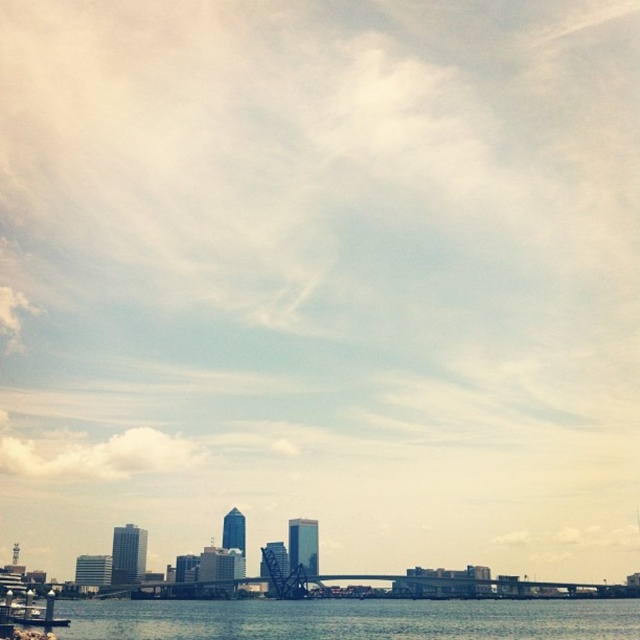
You are standing at the point where the bridge connects to the shore. You want to walk to the clear water at lower center located at point (352,620). Which direction should you head towards?

You should head towards the lower center direction to reach the clear water at lower center located at point (352,620).

You are standing on the bridge in the middle ground and want to look at the clear water at lower center and the metallic gray boat at lower left. Which object appears taller from your vantage point?

The clear water at lower center appears taller than the metallic gray boat at lower left from your vantage point on the bridge.